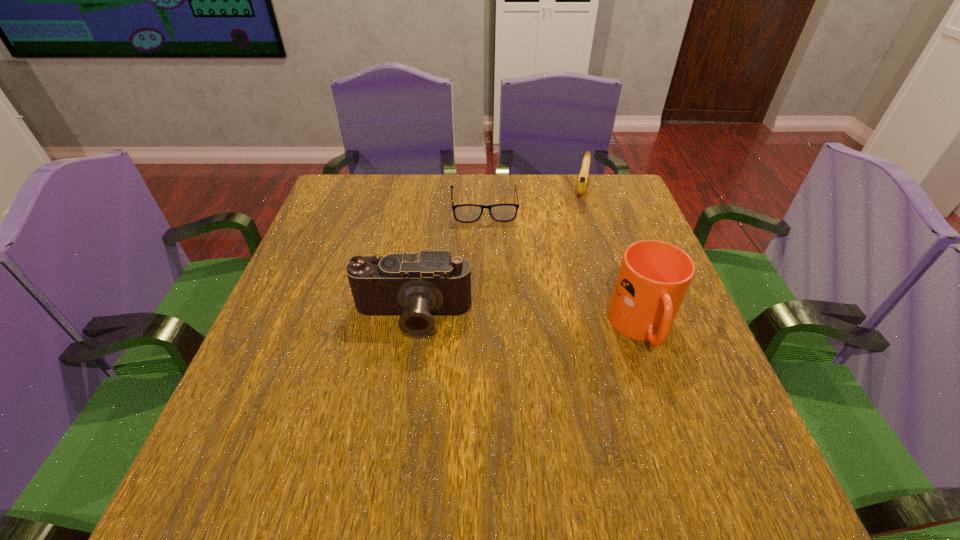
You are a GUI agent. You are given a task and a screenshot of the screen. Output one action in this format:
    pyautogui.click(x=<x>, y=<y>)
    Task: Click on the vacant spot on the desktop that is between the camera and the tallest object and is positioned at the stem of the banana
    Image resolution: width=960 pixels, height=540 pixels.
    Given the screenshot: What is the action you would take?
    pyautogui.click(x=555, y=325)

Identify the location of vacant space on the desktop that is between the second tallest object and the mug and is positioned on the front-facing side of the spectacles. (495, 321).